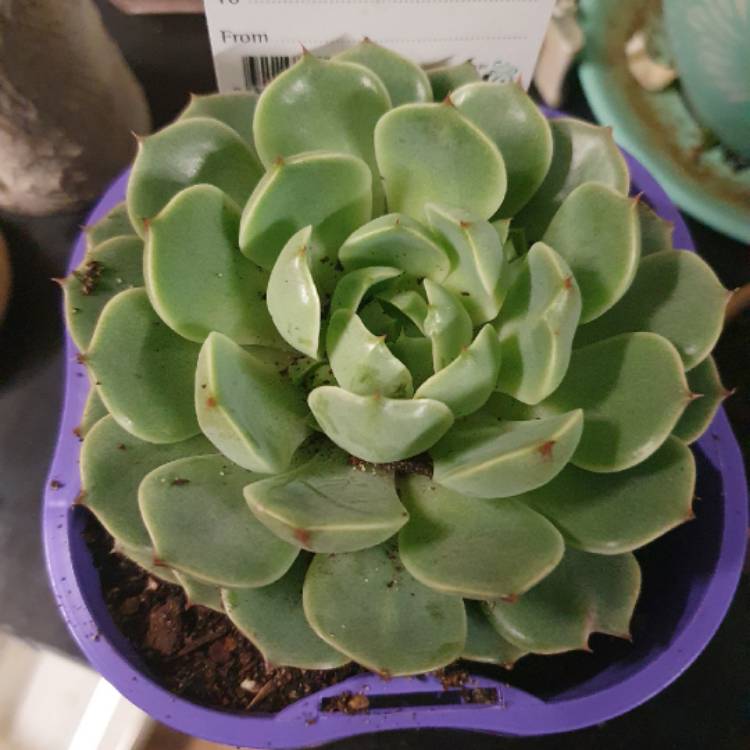
Where is `purple planter`? The width and height of the screenshot is (750, 750). purple planter is located at coordinates (642, 688).